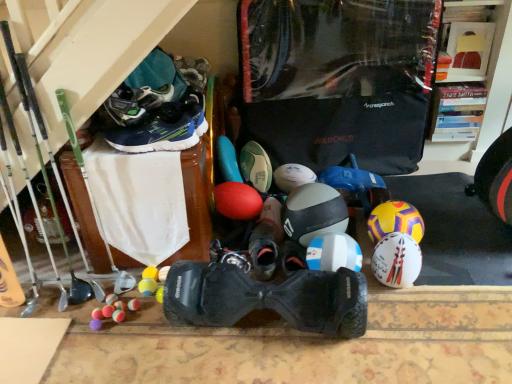
The width and height of the screenshot is (512, 384). Identify the location of empty space that is to the right of white matte helmet at right, arranged as the 1th helmet when viewed from the right. (445, 251).